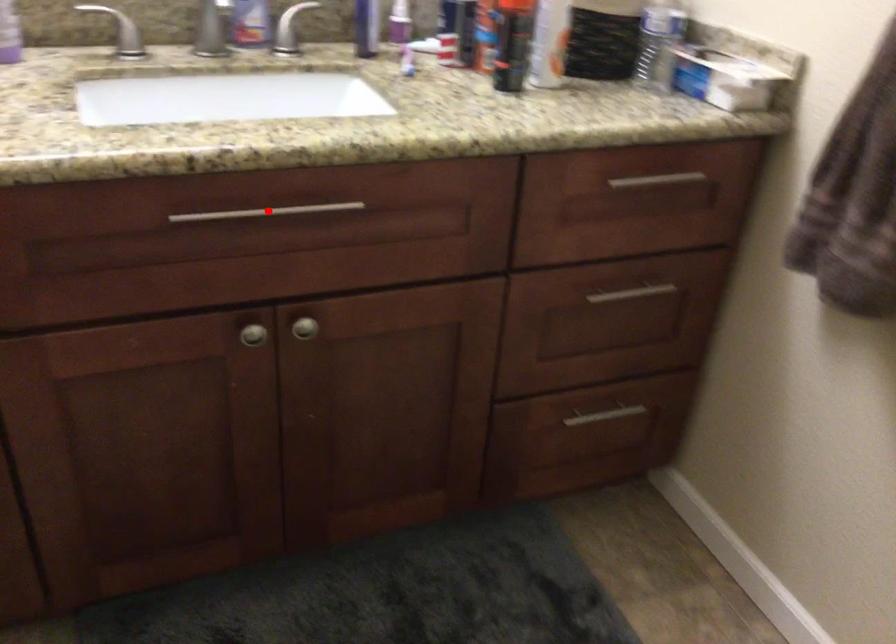
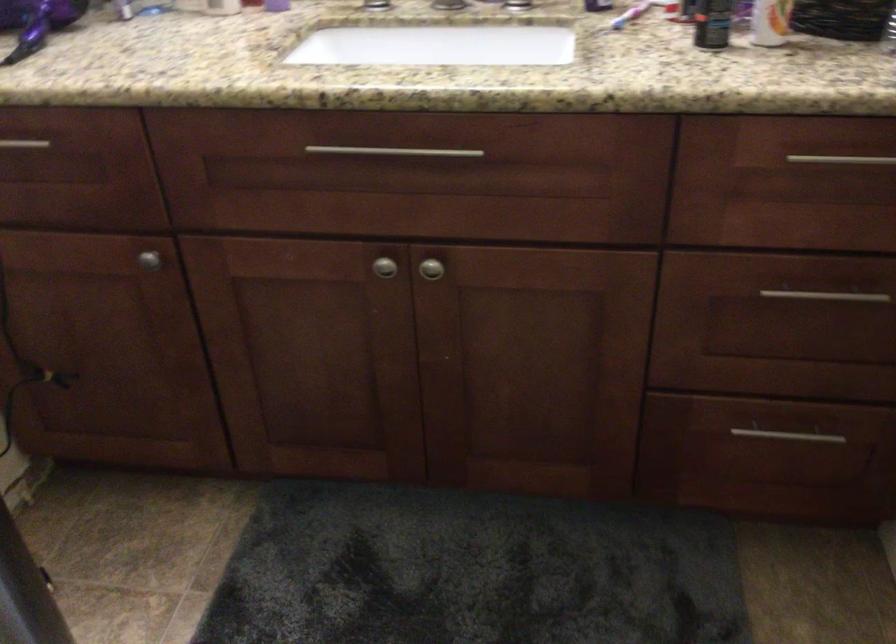
In the second image, find the point that corresponds to the highlighted location in the first image.

(394, 152)